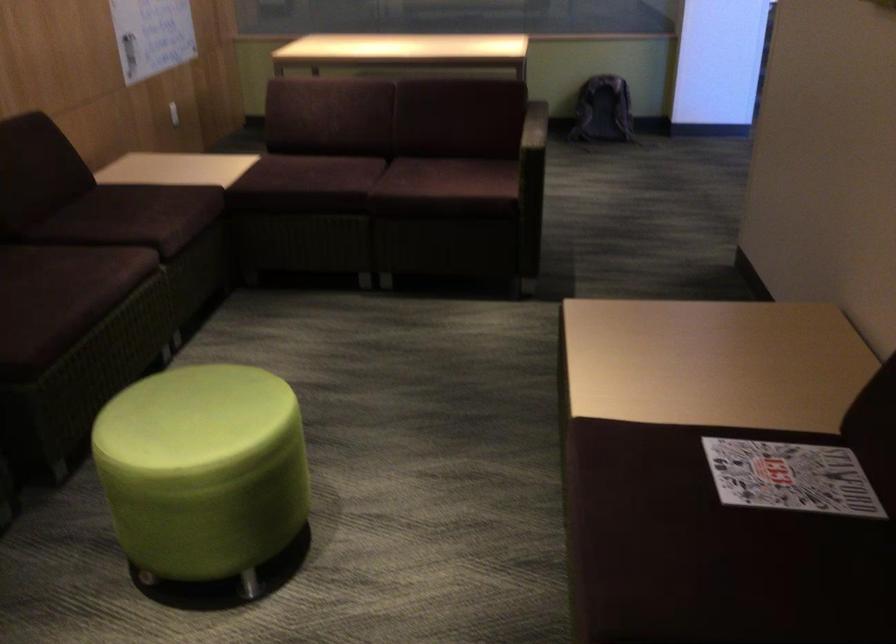
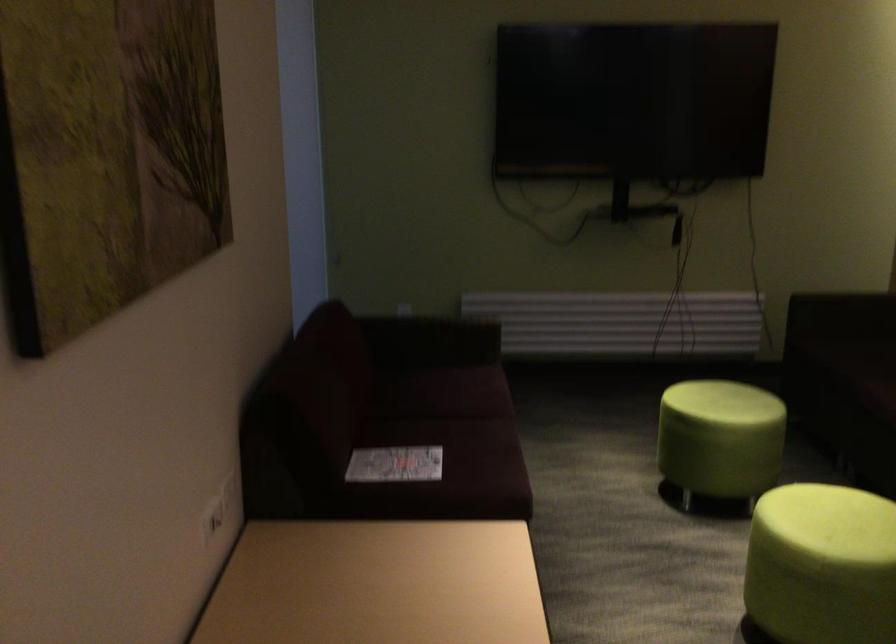
Find the pixel in the second image that matches the point at 272,386 in the first image.

(822, 565)